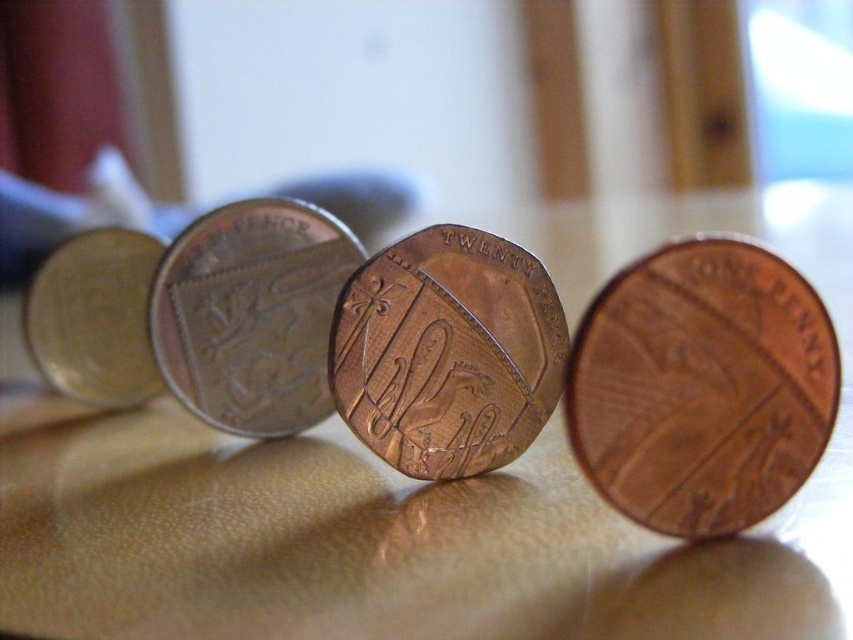
You are taking a photo of the coins and want to focus on the point at point (x=250, y=227) and point (x=74, y=305). Which point should you focus on first to ensure both are in focus?

You should focus on point (x=250, y=227) first because it is closer to the camera than point (x=74, y=305), so adjusting focus from near to far will help both points come into focus.

You are a photographer setting up a shot of the shiny brown table at center. Your camera can focus on objects within 30 inches. Will the table be in focus?

The shiny brown table at center is 30.67 inches away from the camera, which is slightly beyond the 30 inch focus range. Therefore, the table will not be in focus.